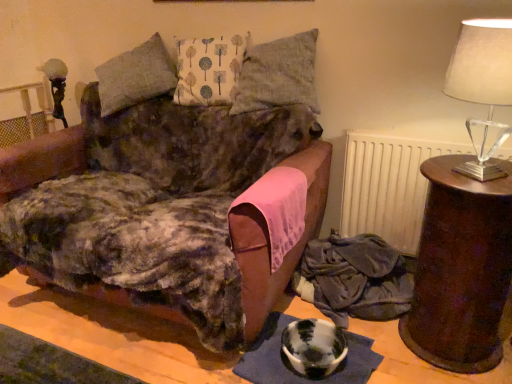
Question: Is velvet brown couch at center wider or thinner than translucent glass lampshade at right?

Choices:
 (A) wide
 (B) thin

Answer: (A)

Question: From the image's perspective, is velvet brown couch at center located above or below translucent glass lampshade at right?

Choices:
 (A) above
 (B) below

Answer: (B)

Question: Estimate the real-world distances between objects in this image. Which object is farther from the textured linen pillow at upper center, which ranks as the first pillow in right-to-left order?

Choices:
 (A) velvet brown couch at center
 (B) white printed cushion at center, placed as the first pillow when sorted from left to right
 (C) brown wooden side table at right
 (D) translucent glass lampshade at right
 (E) white matte radiator at upper right

Answer: (C)

Question: Estimate the real-world distances between objects in this image. Which object is closer to the marble-like white bowl at lower center?

Choices:
 (A) textured linen pillow at upper center, which ranks as the first pillow in right-to-left order
 (B) velvet brown couch at center
 (C) velvet fabric blanket at lower right
 (D) translucent glass lampshade at right
 (E) white printed cushion at center, placed as the first pillow when sorted from left to right

Answer: (C)